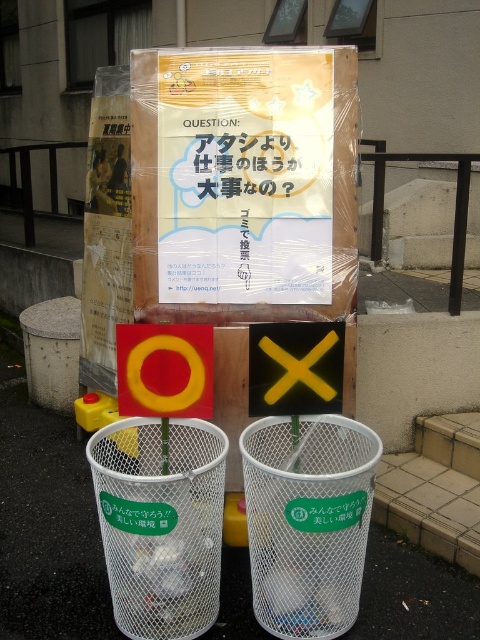
Question: Is white mesh basket at lower left to the left of yellow plastic sign at center from the viewer's perspective?

Choices:
 (A) yes
 (B) no

Answer: (A)

Question: Which point is farther from the camera taking this photo?

Choices:
 (A) (216, 611)
 (B) (117, 346)
 (C) (50, 461)

Answer: (C)

Question: Based on their relative distances, which object is nearer to the white mesh basket at center?

Choices:
 (A) yellow matte circle at center
 (B) yellow plastic sign at center

Answer: (B)

Question: Can you confirm if white mesh bin at lower center is positioned to the left of white mesh basket at center?

Choices:
 (A) yes
 (B) no

Answer: (A)

Question: Is white mesh basket at lower left wider than yellow matte circle at center?

Choices:
 (A) yes
 (B) no

Answer: (A)

Question: Among these objects, which one is nearest to the camera?

Choices:
 (A) yellow matte circle at center
 (B) white mesh bin at lower center
 (C) white mesh basket at center

Answer: (C)